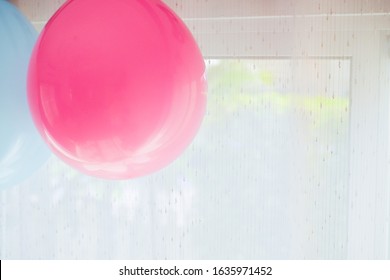
The image size is (390, 280). I want to click on white window frame, so click(340, 45).